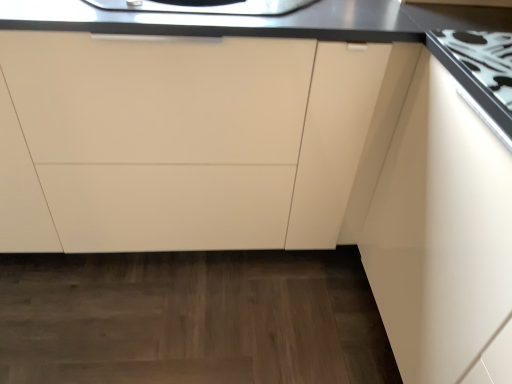
Question: Should I look upward or downward to see white glossy gas stove at upper right?

Choices:
 (A) down
 (B) up

Answer: (B)

Question: Considering the relative sizes of matte white cabinet at center and white glossy gas stove at upper right in the image provided, is matte white cabinet at center wider than white glossy gas stove at upper right?

Choices:
 (A) no
 (B) yes

Answer: (B)

Question: Is matte white cabinet at center smaller than white glossy gas stove at upper right?

Choices:
 (A) no
 (B) yes

Answer: (A)

Question: From the image's perspective, does matte white cabinet at center appear higher than white glossy gas stove at upper right?

Choices:
 (A) yes
 (B) no

Answer: (B)

Question: Can you confirm if matte white cabinet at center is thinner than white glossy gas stove at upper right?

Choices:
 (A) yes
 (B) no

Answer: (B)

Question: Could you tell me if matte white cabinet at center is turned towards white glossy gas stove at upper right?

Choices:
 (A) yes
 (B) no

Answer: (B)

Question: Does matte white cabinet at center lie behind white glossy gas stove at upper right?

Choices:
 (A) yes
 (B) no

Answer: (A)

Question: Is white glossy gas stove at upper right far from matte white cabinet at center?

Choices:
 (A) yes
 (B) no

Answer: (B)

Question: Is white glossy gas stove at upper right oriented towards matte white cabinet at center?

Choices:
 (A) yes
 (B) no

Answer: (B)

Question: Is white glossy gas stove at upper right outside of matte white cabinet at center?

Choices:
 (A) yes
 (B) no

Answer: (A)

Question: Can you confirm if white glossy gas stove at upper right is bigger than matte white cabinet at center?

Choices:
 (A) no
 (B) yes

Answer: (A)

Question: Does white glossy gas stove at upper right have a lesser width compared to matte white cabinet at center?

Choices:
 (A) yes
 (B) no

Answer: (A)

Question: Is white glossy gas stove at upper right taller than matte white cabinet at center?

Choices:
 (A) yes
 (B) no

Answer: (B)

Question: From the image's perspective, is matte white cabinet at center above or below white glossy gas stove at upper right?

Choices:
 (A) below
 (B) above

Answer: (A)